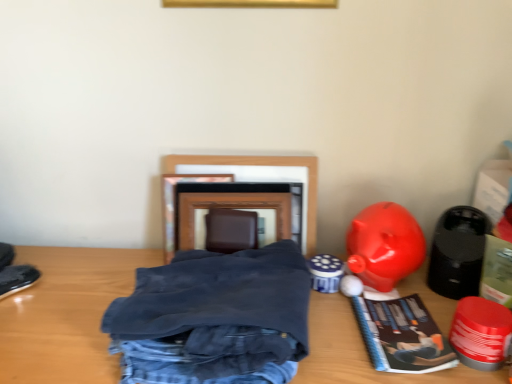
What are the coordinates of `vacant region to the left of matte paper book at lower right` in the screenshot? It's located at (335, 340).